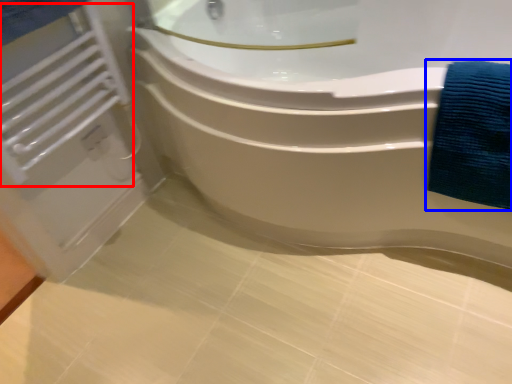
Question: Which object appears closest to the camera in this image, radiator (highlighted by a red box) or bath towel (highlighted by a blue box)?

Choices:
 (A) radiator
 (B) bath towel

Answer: (B)